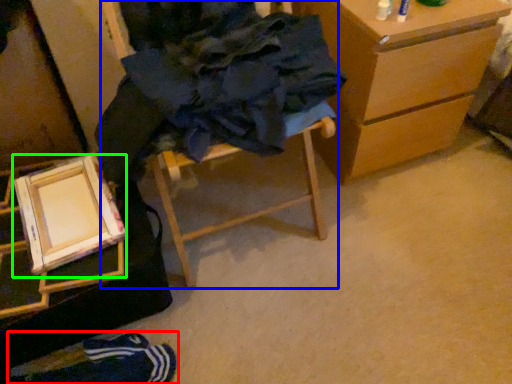
Question: Which is farther away from person (highlighted by a red box)? furniture (highlighted by a blue box) or picture frame (highlighted by a green box)?

Choices:
 (A) furniture
 (B) picture frame

Answer: (A)